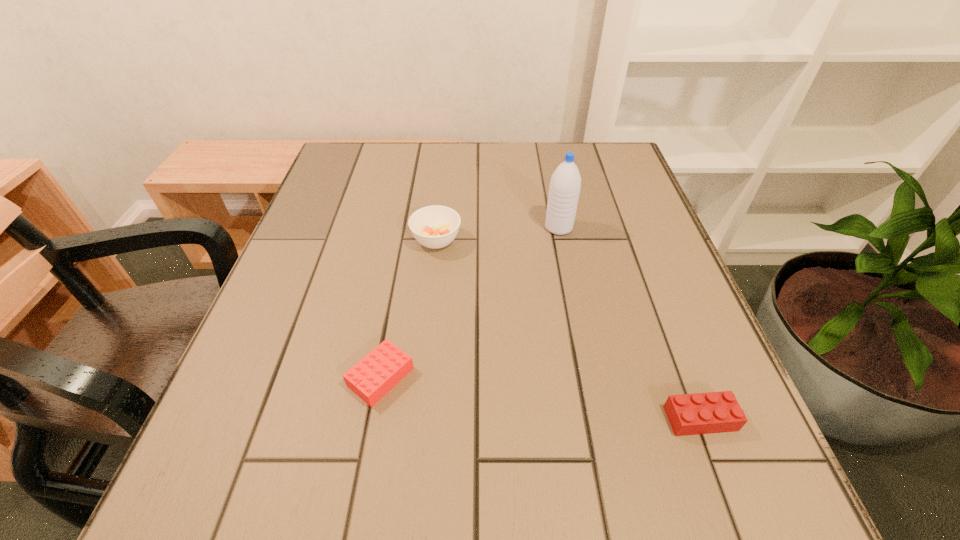
Locate an element on the screen. The width and height of the screenshot is (960, 540). free area in between the left Lego and the second object from right to left is located at coordinates (469, 302).

Where is `blank region between the left Lego and the water bottle`? blank region between the left Lego and the water bottle is located at coordinates (469, 302).

Image resolution: width=960 pixels, height=540 pixels. I want to click on vacant space that's between the tallest object and the rightmost object, so click(x=630, y=323).

The image size is (960, 540). I want to click on empty space that is in between the third object from left to right and the right Lego, so click(630, 323).

You are a GUI agent. You are given a task and a screenshot of the screen. Output one action in this format:
    pyautogui.click(x=<x>, y=<y>)
    Task: Click on the free area in between the soup bowl and the tallest object
    The width and height of the screenshot is (960, 540).
    Given the screenshot: What is the action you would take?
    pyautogui.click(x=497, y=234)

This screenshot has width=960, height=540. I want to click on vacant region between the left Lego and the rightmost object, so click(x=540, y=398).

In order to click on object that is the third closest to the third shortest object in this screenshot , I will do `click(714, 412)`.

Select which object appears as the third closest to the rightmost object. Please provide its 2D coordinates. Your answer should be formatted as a tuple, i.e. [(x, y)], where the tuple contains the x and y coordinates of a point satisfying the conditions above.

[(436, 226)]

Image resolution: width=960 pixels, height=540 pixels. I want to click on free space that satisfies the following two spatial constraints: 1. on the back side of the soup bowl; 2. on the right side of the left Lego, so click(406, 240).

At what (x,y) coordinates should I click in order to perform the action: click on free space that satisfies the following two spatial constraints: 1. on the back side of the left Lego; 2. on the left side of the water bottle. Please return your answer as a coordinate pair (x, y). This screenshot has height=540, width=960. Looking at the image, I should click on (408, 228).